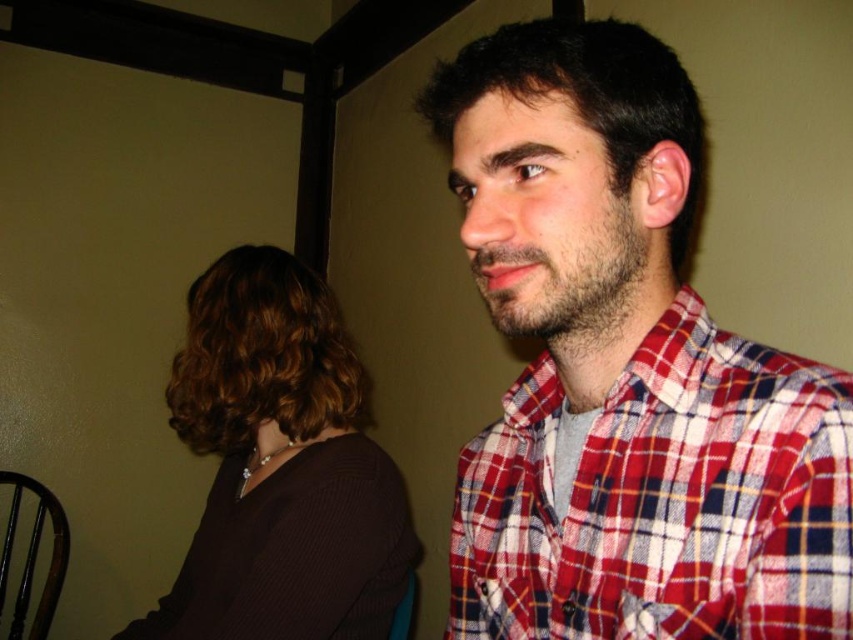
Is plaid fabric shirt at center taller than brown matte hair at upper left?

No, plaid fabric shirt at center is not taller than brown matte hair at upper left.

Can you confirm if plaid fabric shirt at center is bigger than brown matte hair at upper left?

Actually, plaid fabric shirt at center might be smaller than brown matte hair at upper left.

Find the location of `plaid fabric shirt at center`. plaid fabric shirt at center is located at coordinates (625, 371).